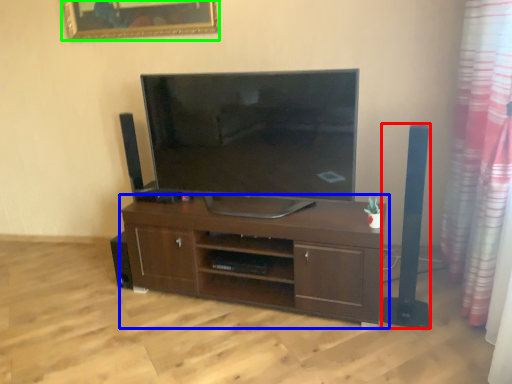
Question: Which object is the closest to the speaker (highlighted by a red box)? Choose among these: cabinetry (highlighted by a blue box) or picture frame (highlighted by a green box).

Choices:
 (A) cabinetry
 (B) picture frame

Answer: (A)